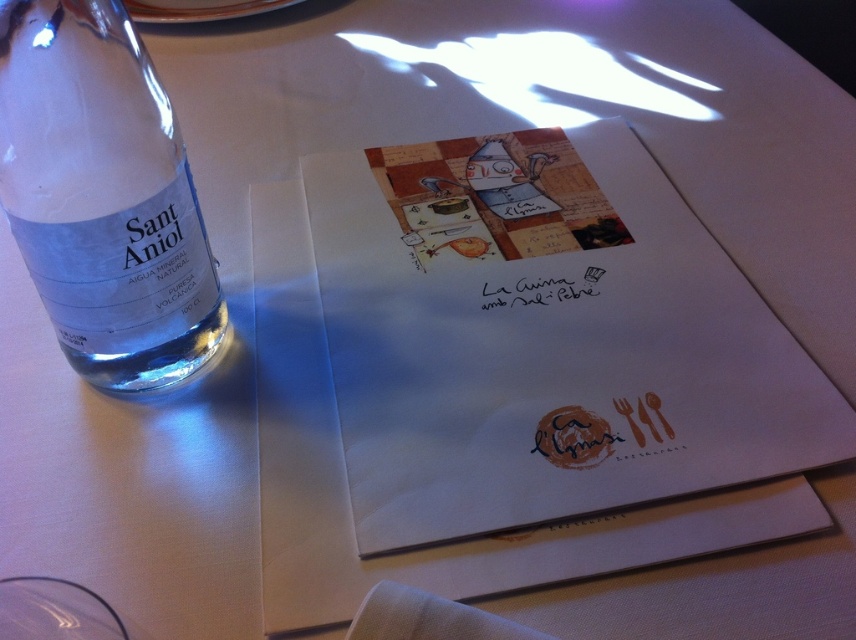
Question: Can you confirm if white paper menu at center is positioned below clear glass bottle at left?

Choices:
 (A) no
 (B) yes

Answer: (B)

Question: Which object appears closest to the camera in this image?

Choices:
 (A) clear glass bottle at left
 (B) white paper menu at center

Answer: (A)

Question: Is white paper menu at center to the left of clear glass bottle at left from the viewer's perspective?

Choices:
 (A) no
 (B) yes

Answer: (A)

Question: Which of the following is the farthest from the observer?

Choices:
 (A) white paper menu at center
 (B) clear glass bottle at left

Answer: (A)

Question: Does white paper menu at center appear over clear glass bottle at left?

Choices:
 (A) no
 (B) yes

Answer: (A)